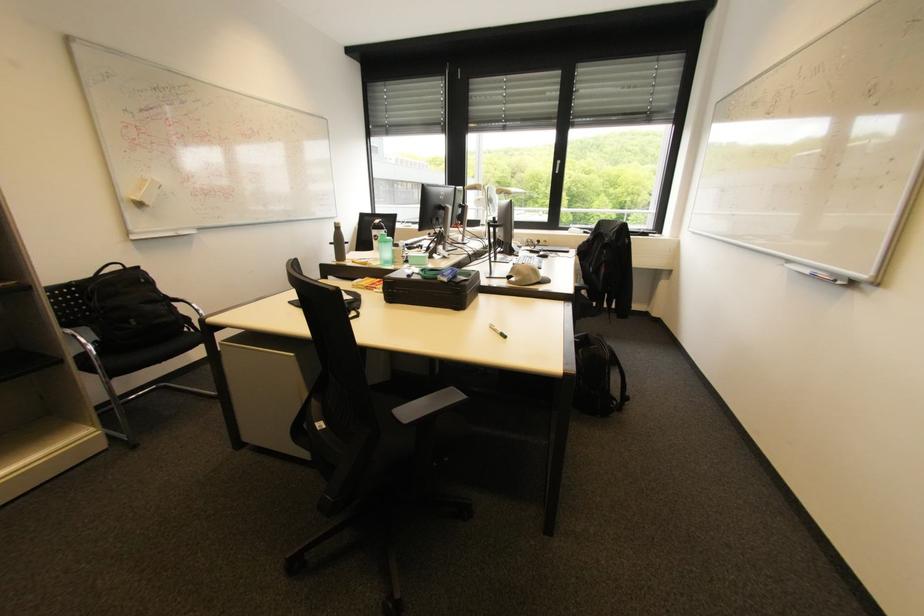
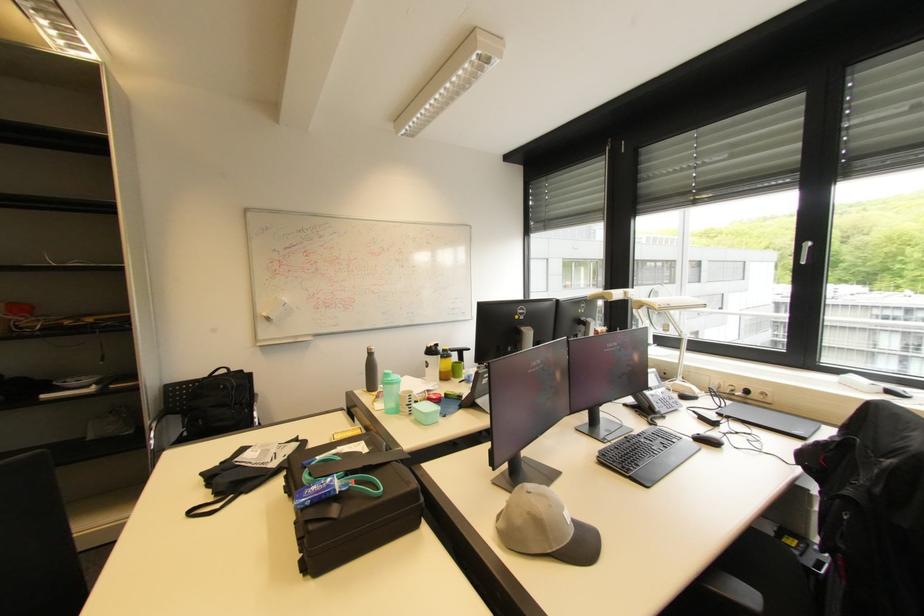
In the second image, find the point that corresponds to point 341,225 in the first image.

(372, 350)